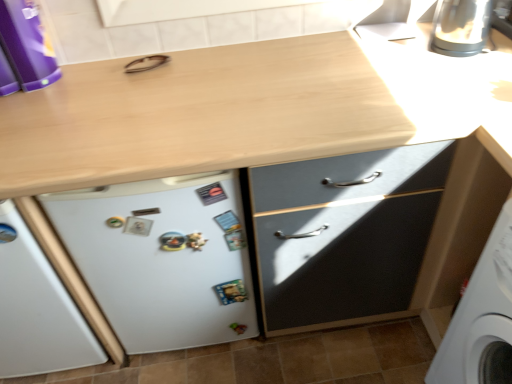
Question: Is point (446, 3) closer or farther from the camera than point (122, 253)?

Choices:
 (A) closer
 (B) farther

Answer: (B)

Question: Considering the positions of satin silver kettle at upper right and white matte refrigerator at lower left in the image, is satin silver kettle at upper right bigger or smaller than white matte refrigerator at lower left?

Choices:
 (A) small
 (B) big

Answer: (A)

Question: Estimate the real-world distances between objects in this image. Which object is farther from the satin silver kettle at upper right?

Choices:
 (A) white matte refrigerator at lower left
 (B) purple plastic container at upper left

Answer: (B)

Question: Estimate the real-world distances between objects in this image. Which object is farther from the purple plastic container at upper left?

Choices:
 (A) satin silver kettle at upper right
 (B) white matte refrigerator at lower left

Answer: (A)